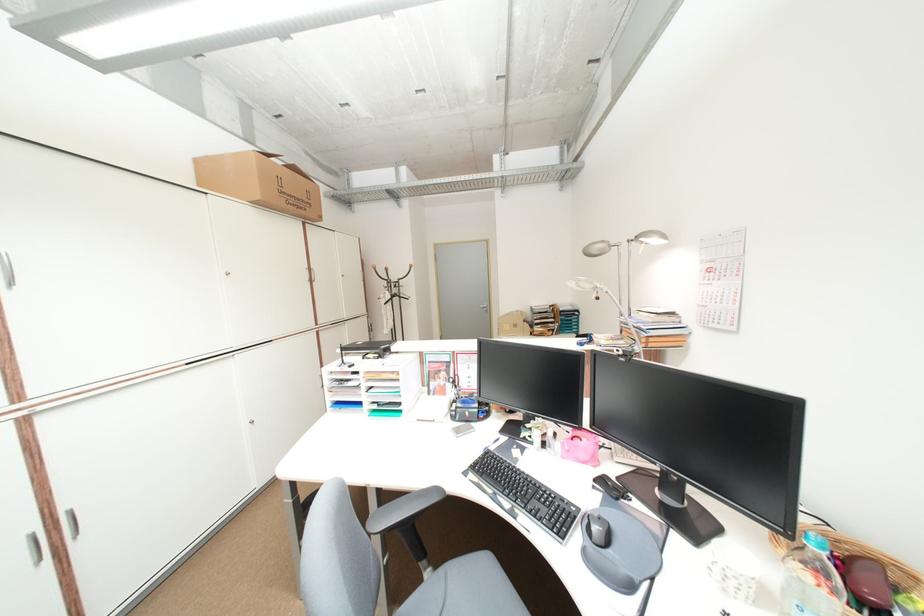
The height and width of the screenshot is (616, 924). What do you see at coordinates (485, 310) in the screenshot? I see `the door handle` at bounding box center [485, 310].